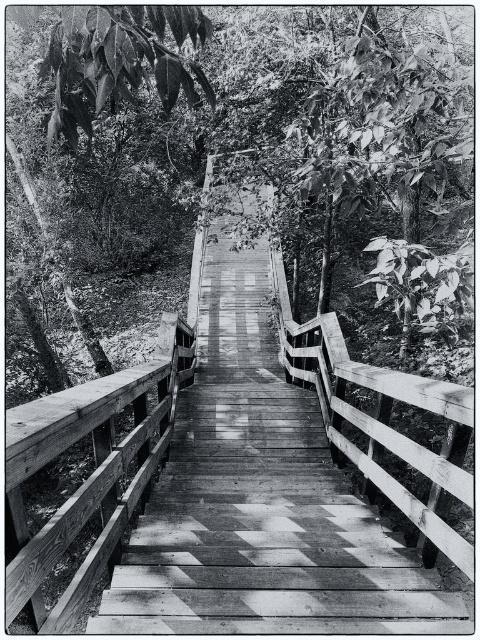
Is point (167, 182) in front of point (412, 401)?

No, (167, 182) is behind (412, 401).

Between point (169, 83) and point (232, 289), which one is positioned behind?

The point (232, 289) is behind.

This screenshot has height=640, width=480. Describe the element at coordinates (240, 131) in the screenshot. I see `smooth green leaves at upper center` at that location.

Locate an element on the screen. The height and width of the screenshot is (640, 480). smooth green leaves at upper center is located at coordinates (240, 131).